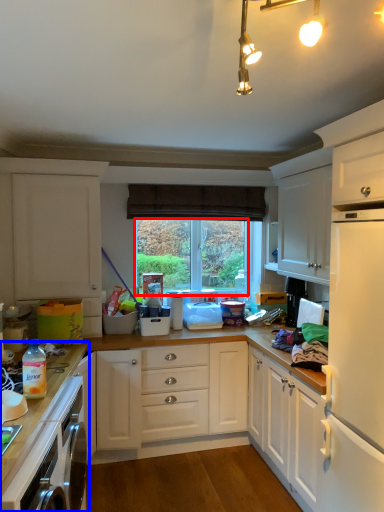
Question: Among these objects, which one is farthest to the camera, window screen (highlighted by a red box) or countertop (highlighted by a blue box)?

Choices:
 (A) window screen
 (B) countertop

Answer: (A)